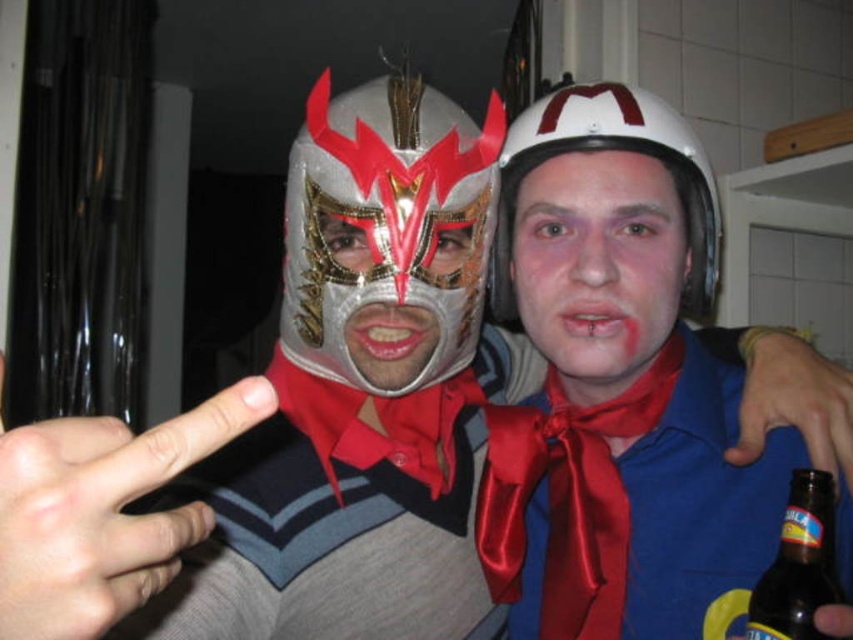
You are at a costume party and need to decide which headpiece to wear. You see the white matte helmet at center and the metallic silver mask at center in the image. Which one is positioned higher on the head?

The white matte helmet at center is positioned higher on the head than the metallic silver mask at center because it is described as being above it.

You are at a costume party and see two people wearing the silver metallic mask at center and the white matte helmet at center. If you want to greet the person on the right side first, which one should you approach?

The white matte helmet at center is on the right side, so you should approach the white matte helmet at center first.

You are at a costume party and see two people wearing the white matte helmet at center and the metallic silver mask at center. Which one is positioned to the right side of the other?

The white matte helmet at center is to the right of the metallic silver mask at center.